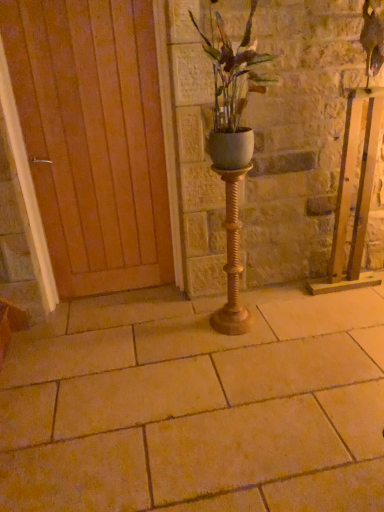
You are a GUI agent. You are given a task and a screenshot of the screen. Output one action in this format:
    pyautogui.click(x=<x>, y=<y>)
    Task: Click on the vacant space in between wooden at left and gold textured candle holder at center
    The image size is (384, 512).
    Given the screenshot: What is the action you would take?
    pyautogui.click(x=159, y=313)